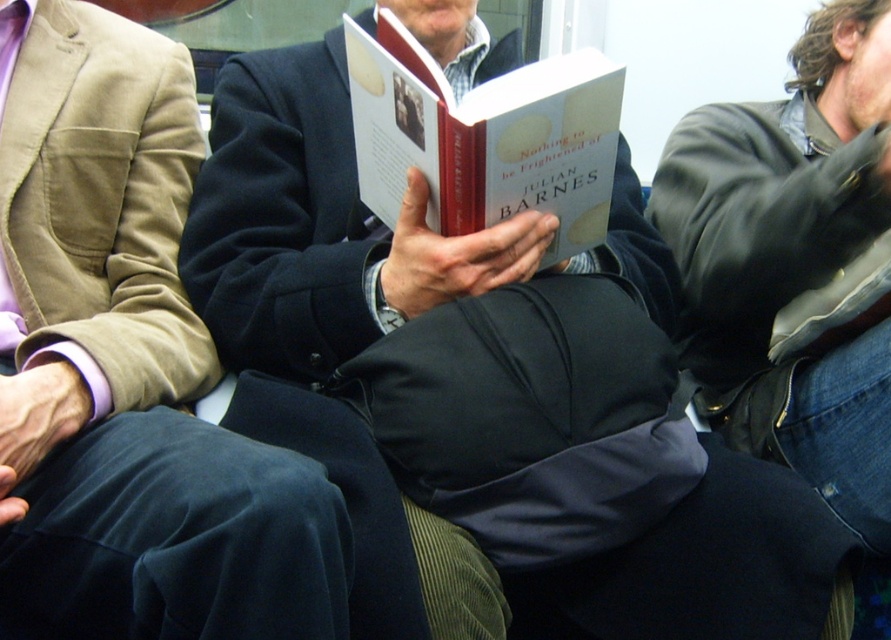
In the scene shown: You are a tailor who needs to determine if a new coat can fit into a storage box designed for items up to the size of the hardcover book at center. Based on the scene, can the matte black jacket at center fit into the box?

The matte black jacket at center is wider than the hardcover book at center, so it cannot fit into the storage box designed for the book size.

You are a tailor measuring jackets for alterations. You need to determine which jacket, the matte black jacket at center or the leather jacket at right, requires a wider alteration for the sleeves. Based on the scene, which one should you prioritize?

The matte black jacket at center requires wider sleeve alterations because its width surpasses that of the leather jacket at right.

You are a photographer standing in front of the scene. You want to take a closeup photo of the matte black jacket at center without including the other people in the background. Based on the distance provided, is it possible to do so?

The matte black jacket at center is 28.95 inches away from viewer. At this distance, it is possible to adjust the camera focus and aperture to blur the background, thus excluding the other people while capturing the jacket in focus.